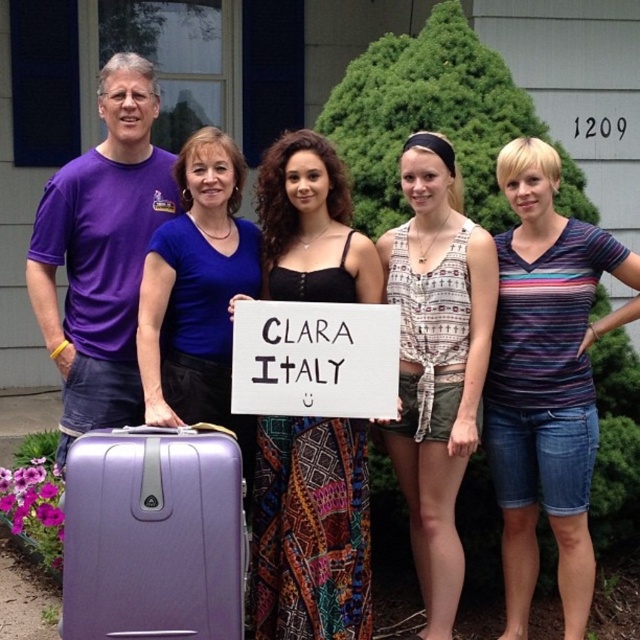
Between point (365, 609) and point (461, 257), which one is positioned in front?

Positioned in front is point (461, 257).

Is point (339, 625) behind point (477, 376)?

No, it is not.

Image resolution: width=640 pixels, height=640 pixels. I want to click on black textured dress at center, so click(x=310, y=531).

Between patterned fabric tank top at center and matte purple suitcase at left, which one appears on the left side from the viewer's perspective?

matte purple suitcase at left is more to the left.

Can you confirm if patterned fabric tank top at center is thinner than matte purple suitcase at left?

Yes, patterned fabric tank top at center is thinner than matte purple suitcase at left.

Identify the location of patterned fabric tank top at center. (436, 362).

Where is `patterned fabric tank top at center`? Image resolution: width=640 pixels, height=640 pixels. patterned fabric tank top at center is located at coordinates (436, 362).

Does black textured dress at center appear over white paper sign at center?

Incorrect, black textured dress at center is not positioned above white paper sign at center.

Who is taller, black textured dress at center or white paper sign at center?

Standing taller between the two is black textured dress at center.

Which is in front, point (333, 538) or point (339, 339)?

Positioned in front is point (339, 339).

This screenshot has height=640, width=640. I want to click on black textured dress at center, so click(x=310, y=531).